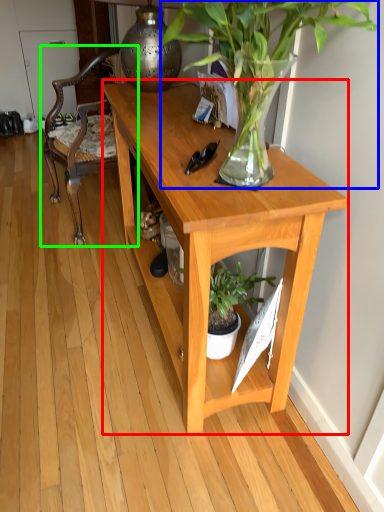
Question: Which is farther away from desk (highlighted by a red box)? houseplant (highlighted by a blue box) or chair (highlighted by a green box)?

Choices:
 (A) houseplant
 (B) chair

Answer: (B)